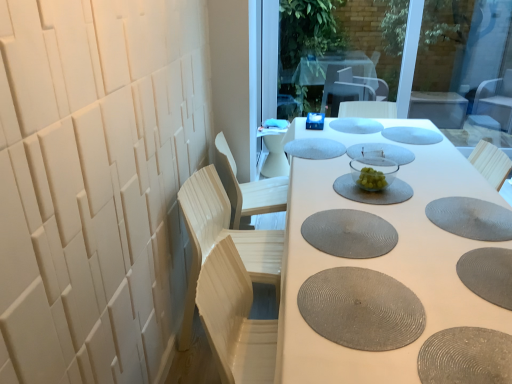
Where is `vacant area that lies between clear glass bowl at center, which is the fourth manhole cover in back-to-front order, and clear glass bowl at center, which is counted as the 5th manhole cover, starting from the back`? The height and width of the screenshot is (384, 512). vacant area that lies between clear glass bowl at center, which is the fourth manhole cover in back-to-front order, and clear glass bowl at center, which is counted as the 5th manhole cover, starting from the back is located at coordinates (373, 167).